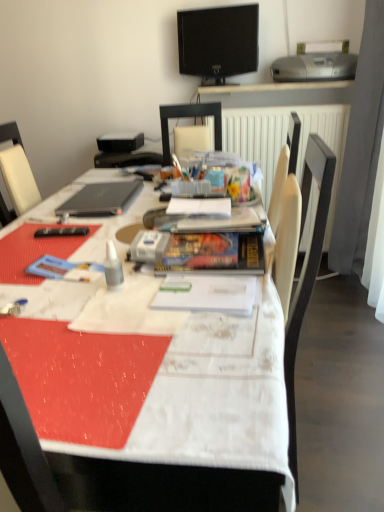
The width and height of the screenshot is (384, 512). What are the coordinates of `vacant area that is in front of sleek black laptop at upper left` in the screenshot? It's located at (74, 229).